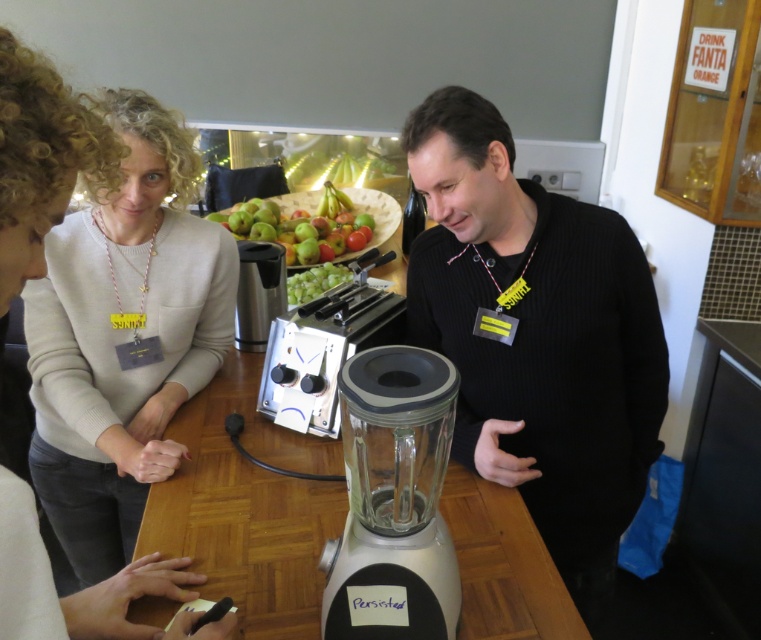
Is point (172, 513) less distant than point (274, 230)?

Yes, it is.

Does wooden table at center appear on the left side of green matte fruit bowl at center?

Incorrect, wooden table at center is not on the left side of green matte fruit bowl at center.

Which is in front, point (240, 372) or point (336, 220)?

Positioned in front is point (240, 372).

In order to click on wooden table at center in this screenshot , I will do pos(247,508).

Does light beige sweater at center come behind green matte fruit bowl at center?

No, light beige sweater at center is closer to the viewer.

Does point (147, 256) come in front of point (325, 234)?

Yes.

Describe the element at coordinates (123, 337) in the screenshot. The width and height of the screenshot is (761, 640). I see `light beige sweater at center` at that location.

Image resolution: width=761 pixels, height=640 pixels. I want to click on light beige sweater at center, so click(x=123, y=337).

Is wooden table at center in front of transparent glass blender at center?

No.

Who is shorter, wooden table at center or transparent glass blender at center?

wooden table at center

This screenshot has width=761, height=640. What are the coordinates of `wooden table at center` in the screenshot? It's located at (247, 508).